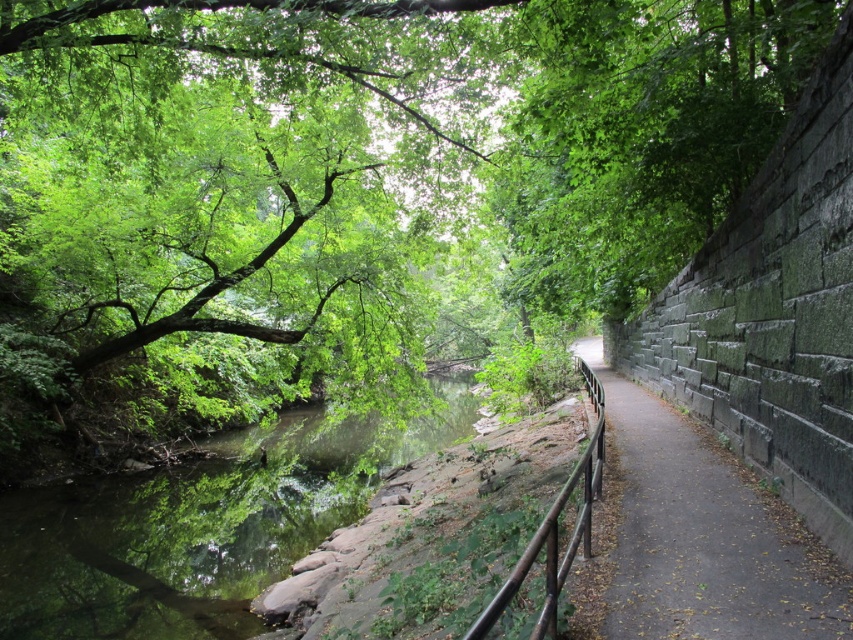
You are standing on the pathway and want to take a photo of the green reflective water at center and the brown wooden rail at center. Which object will appear closer to the camera in the photo?

The green reflective water at center will appear closer to the camera in the photo because it is further to the viewer than the brown wooden rail at center.

From the picture: You are standing on the pathway next to the water and see two points marked in the scene. Which point, point (22, 608) or point (569, 486), is closer to you?

Point (22, 608) is closer to you because it is further to the viewer than point (569, 486).